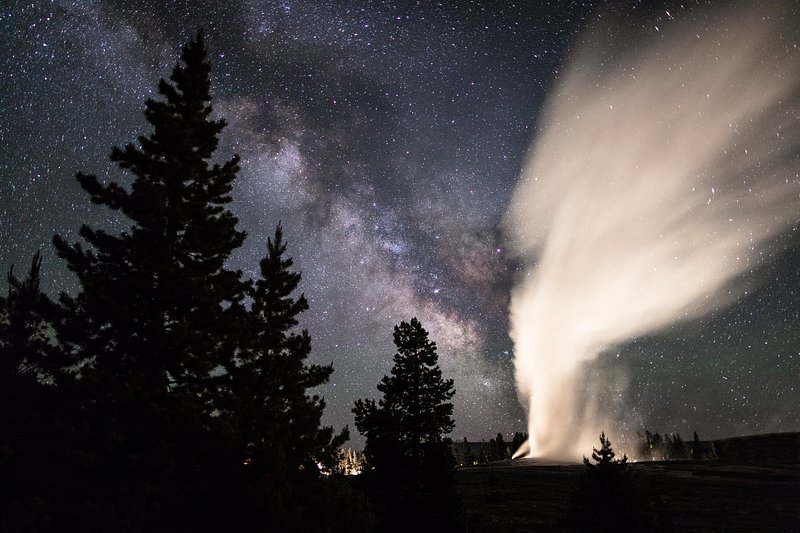
The height and width of the screenshot is (533, 800). What are the coordinates of `bottom left corner empty space` in the screenshot? It's located at [x=26, y=510].